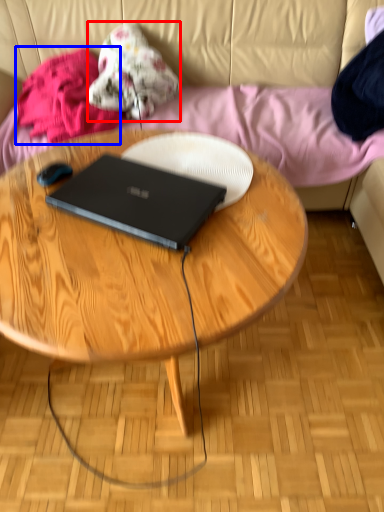
Question: Which point is further to the camera, clothing (highlighted by a red box) or clothing (highlighted by a blue box)?

Choices:
 (A) clothing
 (B) clothing

Answer: (A)